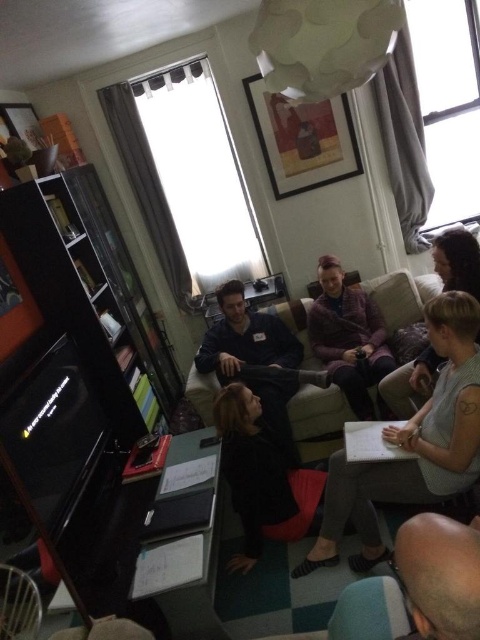
Question: Which object is the closest to the velvet beige couch at center?

Choices:
 (A) wooden armchair at lower left
 (B) velvet maroon sweater at center
 (C) bald head at center

Answer: (B)

Question: Can you confirm if bald head at center is positioned to the left of velvet beige couch at center?

Choices:
 (A) yes
 (B) no

Answer: (B)

Question: Which point is farther from the camera taking this photo?

Choices:
 (A) (283, 636)
 (B) (333, 264)
 (C) (14, 636)
 (D) (228, 353)

Answer: (B)

Question: Which of the following is the farthest from the observer?

Choices:
 (A) dark blue fleece jacket at center
 (B) velvet green armchair at lower center
 (C) gray fabric sweater at center

Answer: (A)

Question: Considering the relative positions of velvet green armchair at lower center and wooden armchair at lower left in the image provided, where is velvet green armchair at lower center located with respect to wooden armchair at lower left?

Choices:
 (A) below
 (B) above

Answer: (B)

Question: Can you confirm if bald head at center is positioned to the right of wooden armchair at lower left?

Choices:
 (A) no
 (B) yes

Answer: (B)